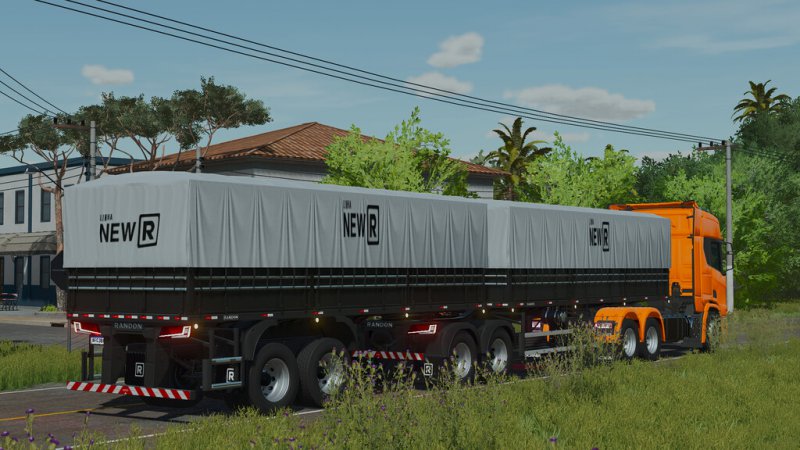
Locate an element on the screen. This screenshot has width=800, height=450. window is located at coordinates (42, 213), (16, 211), (716, 259).